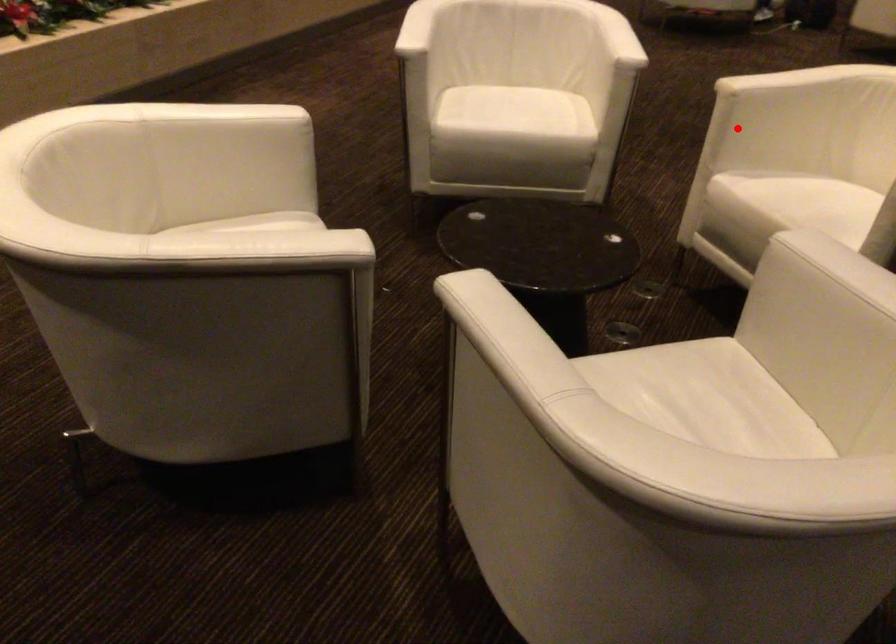
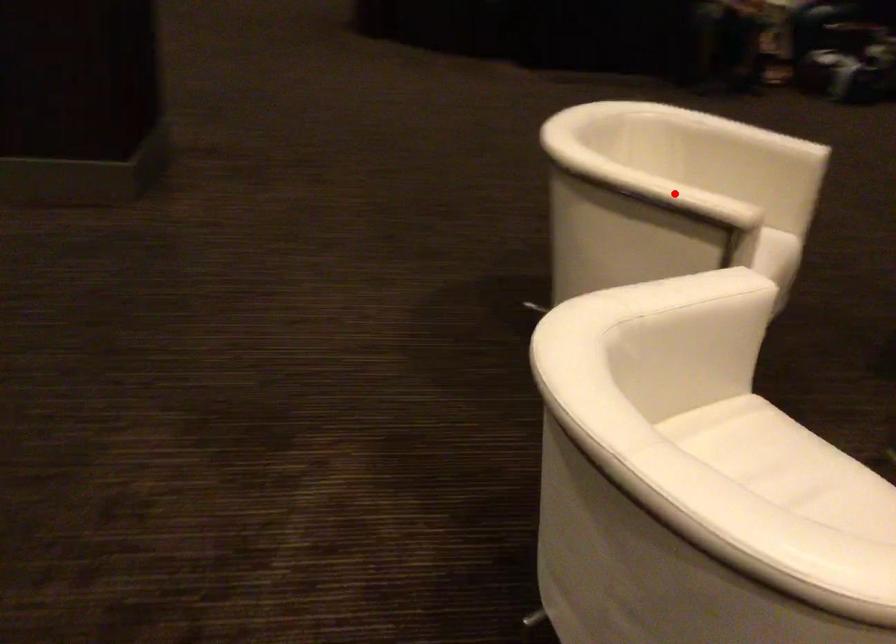
I am providing you with two images of the same scene from different viewpoints. A red point is marked on the first image and another point is marked on the second image. Are the points marked in image1 and image2 representing the same 3D position?

No